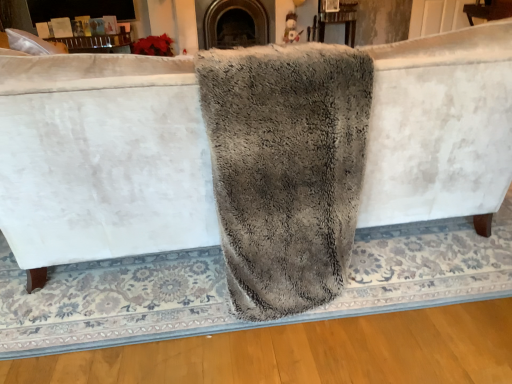
Locate an element on the screen. dark gray stone fireplace at center is located at coordinates (201, 19).

Where is `gray fluffy bath towel at center`? The width and height of the screenshot is (512, 384). gray fluffy bath towel at center is located at coordinates (286, 169).

Image resolution: width=512 pixels, height=384 pixels. I want to click on dark gray stone fireplace at center, so click(201, 19).

Consider the image. Is dark gray stone fireplace at center a part of gray fluffy bath towel at center?

No, dark gray stone fireplace at center is located outside of gray fluffy bath towel at center.

Is gray fluffy bath towel at center facing towards dark gray stone fireplace at center?

Yes, gray fluffy bath towel at center is oriented towards dark gray stone fireplace at center.

Can you tell me how much gray fluffy bath towel at center and dark gray stone fireplace at center differ in facing direction?

They differ by 179 degrees in their facing directions.

From the image's perspective, between gray fluffy bath towel at center and dark gray stone fireplace at center, who is located below?

From the image's view, gray fluffy bath towel at center is below.

Between wooden table at upper center and gray fluffy bath towel at center, which one has larger size?

gray fluffy bath towel at center is bigger.

Considering the positions of points (343, 5) and (248, 105), is point (343, 5) closer to camera compared to point (248, 105)?

No, it is not.

Is gray fluffy bath towel at center surrounded by wooden table at upper center?

No, gray fluffy bath towel at center is not a part of wooden table at upper center.

Which object is thinner, wooden table at upper center or gray fluffy bath towel at center?

wooden table at upper center.

Does dark gray stone fireplace at center appear on the right side of wooden table at upper center?

No.

In the scene shown: Which object is more forward, dark gray stone fireplace at center or wooden table at upper center?

dark gray stone fireplace at center is closer to the camera.

Does dark gray stone fireplace at center turn towards wooden table at upper center?

No, dark gray stone fireplace at center is not turned towards wooden table at upper center.

Is wooden table at upper center surrounded by dark gray stone fireplace at center?

No, wooden table at upper center is located outside of dark gray stone fireplace at center.

Is wooden table at upper center smaller than dark gray stone fireplace at center?

Indeed, wooden table at upper center has a smaller size compared to dark gray stone fireplace at center.

Is wooden table at upper center shorter than dark gray stone fireplace at center?

Indeed, wooden table at upper center has a lesser height compared to dark gray stone fireplace at center.

Is dark gray stone fireplace at center surrounded by wooden table at upper center?

No, dark gray stone fireplace at center is not surrounded by wooden table at upper center.

Is point (349, 37) closer or farther from the camera than point (272, 0)?

Point (349, 37).

Which of these two, gray fluffy bath towel at center or wooden table at upper center, is smaller?

With smaller size is wooden table at upper center.

Is gray fluffy bath towel at center oriented away from wooden table at upper center?

No, wooden table at upper center is not at the back of gray fluffy bath towel at center.

Measure the distance between gray fluffy bath towel at center and wooden table at upper center.

A distance of 2.19 meters exists between gray fluffy bath towel at center and wooden table at upper center.

Is point (212, 1) closer to viewer compared to point (323, 195)?

No.

How distant is dark gray stone fireplace at center from gray fluffy bath towel at center?

A distance of 1.54 meters exists between dark gray stone fireplace at center and gray fluffy bath towel at center.

From the image's perspective, is dark gray stone fireplace at center positioned above or below gray fluffy bath towel at center?

dark gray stone fireplace at center is situated higher than gray fluffy bath towel at center in the image.

Is dark gray stone fireplace at center bigger or smaller than gray fluffy bath towel at center?

dark gray stone fireplace at center is smaller than gray fluffy bath towel at center.

In the image, there is a gray fluffy bath towel at center. At what (x,y) coordinates should I click in order to perform the action: click on fireplace above it (from the image's perspective). Please return your answer as a coordinate pair (x, y). Looking at the image, I should click on (201, 19).

Where is `table on the right of gray fluffy bath towel at center`? The width and height of the screenshot is (512, 384). table on the right of gray fluffy bath towel at center is located at coordinates 339,22.

Estimate the real-world distances between objects in this image. Which object is further from wooden table at upper center, gray fluffy bath towel at center or dark gray stone fireplace at center?

Based on the image, gray fluffy bath towel at center appears to be further to wooden table at upper center.

Considering their positions, is gray fluffy bath towel at center positioned further to dark gray stone fireplace at center than wooden table at upper center?

The object further to dark gray stone fireplace at center is gray fluffy bath towel at center.

From the image, which object appears to be nearer to wooden table at upper center, dark gray stone fireplace at center or gray fluffy bath towel at center?

Based on the image, dark gray stone fireplace at center appears to be nearer to wooden table at upper center.

Estimate the real-world distances between objects in this image. Which object is closer to gray fluffy bath towel at center, dark gray stone fireplace at center or wooden table at upper center?

dark gray stone fireplace at center is positioned closer to the anchor gray fluffy bath towel at center.

Considering their positions, is wooden table at upper center positioned further to gray fluffy bath towel at center than dark gray stone fireplace at center?

Based on the image, wooden table at upper center appears to be further to gray fluffy bath towel at center.

From the image, which object appears to be farther from dark gray stone fireplace at center, wooden table at upper center or gray fluffy bath towel at center?

Based on the image, gray fluffy bath towel at center appears to be further to dark gray stone fireplace at center.

The height and width of the screenshot is (384, 512). I want to click on fireplace between gray fluffy bath towel at center and wooden table at upper center in the front-back direction, so click(201, 19).